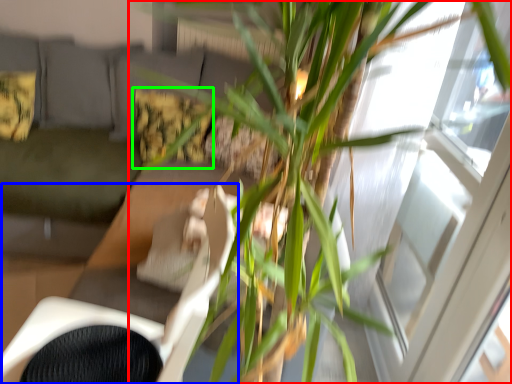
Question: Which object is positioned farthest from houseplant (highlighted by a red box)? Select from swivel chair (highlighted by a blue box) and pillow (highlighted by a green box).

Choices:
 (A) swivel chair
 (B) pillow

Answer: (B)